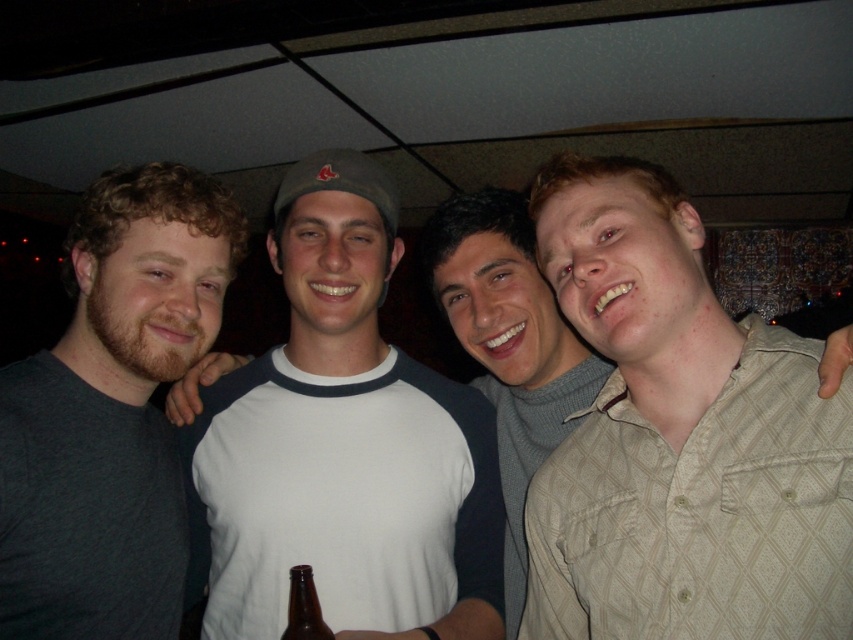
Is light beige textured shirt at right to the left of dark gray t-shirt at left from the viewer's perspective?

No, light beige textured shirt at right is not to the left of dark gray t-shirt at left.

Between light beige textured shirt at right and dark gray t-shirt at left, which one has more height?

dark gray t-shirt at left

Locate an element on the screen. Image resolution: width=853 pixels, height=640 pixels. light beige textured shirt at right is located at coordinates (679, 436).

You are a GUI agent. You are given a task and a screenshot of the screen. Output one action in this format:
    pyautogui.click(x=<x>, y=<y>)
    Task: Click on the light beige textured shirt at right
    Image resolution: width=853 pixels, height=640 pixels.
    Given the screenshot: What is the action you would take?
    pyautogui.click(x=679, y=436)

How far apart are light beige textured shirt at right and white cotton t-shirt at center?

light beige textured shirt at right is 34.27 centimeters from white cotton t-shirt at center.

Is point (576, 488) positioned in front of point (283, 609)?

Yes, point (576, 488) is in front of point (283, 609).

This screenshot has height=640, width=853. What are the coordinates of `light beige textured shirt at right` in the screenshot? It's located at (679, 436).

Can you confirm if white cotton t-shirt at center is taller than dark gray t-shirt at left?

Correct, white cotton t-shirt at center is much taller as dark gray t-shirt at left.

In the scene shown: Can you confirm if white cotton t-shirt at center is positioned to the right of dark gray t-shirt at left?

Yes, white cotton t-shirt at center is to the right of dark gray t-shirt at left.

Is point (273, 602) less distant than point (99, 442)?

No, it is not.

Find the location of a particular element. Image resolution: width=853 pixels, height=640 pixels. white cotton t-shirt at center is located at coordinates (341, 444).